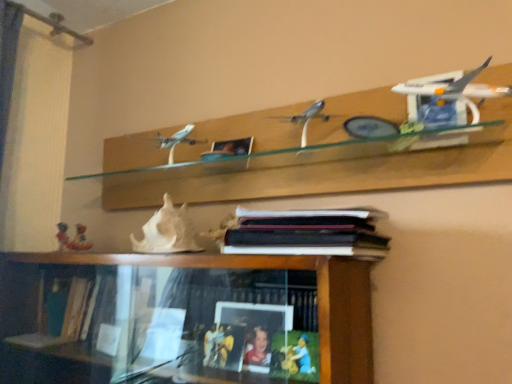
Describe the element at coordinates (457, 90) in the screenshot. Image resolution: width=512 pixels, height=384 pixels. I see `white glossy airplane at upper right` at that location.

The height and width of the screenshot is (384, 512). Describe the element at coordinates (167, 231) in the screenshot. I see `white matte seashell at center, the 1th toy positioned from the right` at that location.

Identify the location of matte plastic toy at lower left, the second toy from the front. This screenshot has width=512, height=384. (80, 240).

Could you measure the distance between white glossy airplane at upper right and matte plastic toy at lower left, the second toy from the front?

white glossy airplane at upper right and matte plastic toy at lower left, the second toy from the front, are 1.28 meters apart from each other.

Locate an element on the screen. aircraft model on the right of matte plastic toy at lower left, the 1th toy from the left is located at coordinates (457, 90).

Is point (488, 64) closer to camera compared to point (86, 244)?

Yes, it is in front of point (86, 244).

Can you confirm if white glossy airplane at upper right is shorter than matte plastic toy at lower left, which is the first toy in back-to-front order?

No, white glossy airplane at upper right is not shorter than matte plastic toy at lower left, which is the first toy in back-to-front order.

From the image's perspective, is hardcover book at center on white glossy airplane at upper right?

Actually, hardcover book at center appears below white glossy airplane at upper right in the image.

Is hardcover book at center located outside white glossy airplane at upper right?

That's correct, hardcover book at center is outside of white glossy airplane at upper right.

Which is more to the left, hardcover book at center or white glossy airplane at upper right?

From the viewer's perspective, hardcover book at center appears more on the left side.

From a real-world perspective, does hardcover book at center stand above white glossy airplane at upper right?

No, from a real-world perspective, hardcover book at center is not above white glossy airplane at upper right.

Consider the image. Is matte plastic toy at lower left, the 1th toy from the left, located outside hardcover book at center?

matte plastic toy at lower left, the 1th toy from the left, is positioned outside hardcover book at center.

From a real-world perspective, starting from the hardcover book at center, which toy is the 1st one vertically above it? Please provide its 2D coordinates.

[(80, 240)]

Could you measure the distance between matte plastic toy at lower left, the 1th toy from the left, and hardcover book at center?

The distance of matte plastic toy at lower left, the 1th toy from the left, from hardcover book at center is 38.12 inches.

Who is more distant, white matte seashell at center, the 1th toy positioned from the right, or white glossy airplane at upper right?

Positioned behind is white matte seashell at center, the 1th toy positioned from the right.

Is white matte seashell at center, acting as the second toy starting from the back, looking in the opposite direction of white glossy airplane at upper right?

No.

Is white matte seashell at center, acting as the second toy starting from the back, situated inside white glossy airplane at upper right or outside?

white matte seashell at center, acting as the second toy starting from the back, is outside white glossy airplane at upper right.

Based on the photo, who is bigger, white glossy airplane at upper right or hardcover book at center?

hardcover book at center is bigger.

How many degrees apart are the facing directions of white glossy airplane at upper right and hardcover book at center?

They differ by 2.78 degrees in their facing directions.

Is white glossy airplane at upper right not close to hardcover book at center?

white glossy airplane at upper right is near hardcover book at center, not far away.

This screenshot has width=512, height=384. In order to click on book below the white glossy airplane at upper right (from the image's perspective) in this screenshot , I will do `click(307, 233)`.

Would you say white matte seashell at center, acting as the second toy starting from the back, is outside matte plastic toy at lower left, the second toy from the front?

Yes, white matte seashell at center, acting as the second toy starting from the back, is not within matte plastic toy at lower left, the second toy from the front.

From the image's perspective, does white matte seashell at center, acting as the second toy starting from the back, appear higher than matte plastic toy at lower left, the 1th toy from the left?

Yes, from the image's perspective, white matte seashell at center, acting as the second toy starting from the back, is on top of matte plastic toy at lower left, the 1th toy from the left.

Consider the image. Considering the relative sizes of white matte seashell at center, which ranks as the second toy in left-to-right order, and matte plastic toy at lower left, which is the first toy in back-to-front order, in the image provided, is white matte seashell at center, which ranks as the second toy in left-to-right order, thinner than matte plastic toy at lower left, which is the first toy in back-to-front order,?

In fact, white matte seashell at center, which ranks as the second toy in left-to-right order, might be wider than matte plastic toy at lower left, which is the first toy in back-to-front order.

From a real-world perspective, is matte plastic toy at lower left, which is the first toy in back-to-front order, physically above white matte seashell at center, which ranks as the second toy in left-to-right order?

No, from a real-world perspective, matte plastic toy at lower left, which is the first toy in back-to-front order, is not above white matte seashell at center, which ranks as the second toy in left-to-right order.

Is matte plastic toy at lower left, which is the first toy in back-to-front order, oriented away from white matte seashell at center, the 1th toy positioned from the right?

matte plastic toy at lower left, which is the first toy in back-to-front order, is not turned away from white matte seashell at center, the 1th toy positioned from the right.

Is matte plastic toy at lower left, which is the first toy in back-to-front order, next to white matte seashell at center, the 1th toy in the front-to-back sequence?

matte plastic toy at lower left, which is the first toy in back-to-front order, and white matte seashell at center, the 1th toy in the front-to-back sequence, are not in contact.

Relative to white matte seashell at center, acting as the second toy starting from the back, is matte plastic toy at lower left, marked as the 2th toy in a right-to-left arrangement, in front or behind?

Clearly, matte plastic toy at lower left, marked as the 2th toy in a right-to-left arrangement, is behind white matte seashell at center, acting as the second toy starting from the back.

This screenshot has height=384, width=512. In order to click on the 2nd toy behind the white glossy airplane at upper right in this screenshot , I will do `click(80, 240)`.

Identify the location of aircraft model that appears in front of the hardcover book at center. This screenshot has width=512, height=384. (457, 90).

From the image, which object appears to be farther from white matte seashell at center, acting as the second toy starting from the back, white glossy airplane at upper right or hardcover book at center?

white glossy airplane at upper right.

From the picture: Which object lies nearer to the anchor point white matte seashell at center, the 1th toy positioned from the right, white glossy airplane at upper right or matte plastic toy at lower left, the 1th toy from the left?

The object closer to white matte seashell at center, the 1th toy positioned from the right, is matte plastic toy at lower left, the 1th toy from the left.

From the image, which object appears to be nearer to hardcover book at center, white glossy airplane at upper right or matte plastic toy at lower left, the 1th toy from the left?

white glossy airplane at upper right is positioned closer to the anchor hardcover book at center.

Which object lies nearer to the anchor point matte plastic toy at lower left, the second toy from the front, white matte seashell at center, which ranks as the second toy in left-to-right order, or hardcover book at center?

The object closer to matte plastic toy at lower left, the second toy from the front, is white matte seashell at center, which ranks as the second toy in left-to-right order.

Based on their spatial positions, is hardcover book at center or matte plastic toy at lower left, which is the first toy in back-to-front order, further from white matte seashell at center, which ranks as the second toy in left-to-right order?

hardcover book at center.

Considering their positions, is white matte seashell at center, the 1th toy positioned from the right, positioned closer to white glossy airplane at upper right than matte plastic toy at lower left, which is the first toy in back-to-front order?

The object closer to white glossy airplane at upper right is white matte seashell at center, the 1th toy positioned from the right.

Which object lies nearer to the anchor point white matte seashell at center, which ranks as the second toy in left-to-right order, matte plastic toy at lower left, the second toy from the front, or white glossy airplane at upper right?

matte plastic toy at lower left, the second toy from the front, lies closer to white matte seashell at center, which ranks as the second toy in left-to-right order, than the other object.

Which object lies nearer to the anchor point white glossy airplane at upper right, white matte seashell at center, acting as the second toy starting from the back, or hardcover book at center?

Among the two, hardcover book at center is located nearer to white glossy airplane at upper right.

The image size is (512, 384). Find the location of `book between matte plastic toy at lower left, the second toy from the front, and white glossy airplane at upper right from left to right`. book between matte plastic toy at lower left, the second toy from the front, and white glossy airplane at upper right from left to right is located at coordinates (307, 233).

You are a GUI agent. You are given a task and a screenshot of the screen. Output one action in this format:
    pyautogui.click(x=<x>, y=<y>)
    Task: Click on the toy situated between matte plastic toy at lower left, the 1th toy from the left, and hardcover book at center from left to right
    Image resolution: width=512 pixels, height=384 pixels.
    Given the screenshot: What is the action you would take?
    pyautogui.click(x=167, y=231)

I want to click on book between white matte seashell at center, acting as the second toy starting from the back, and white glossy airplane at upper right, in the horizontal direction, so click(x=307, y=233).

Find the location of a particular element. toy situated between matte plastic toy at lower left, which is the first toy in back-to-front order, and white glossy airplane at upper right from left to right is located at coordinates (167, 231).